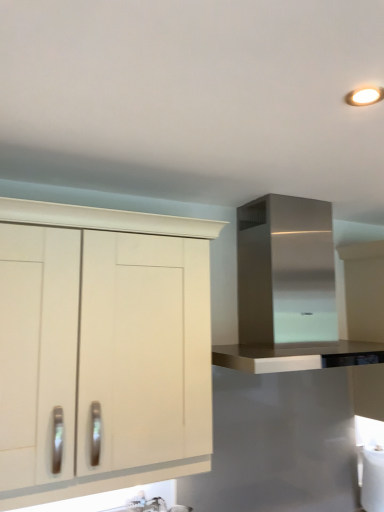
Question: Is white matte cabinet at left, which is the 2th cabinetry in right-to-left order, completely or partially inside stainless steel range hood at upper right, placed as the 2th cabinetry when sorted from left to right?

Choices:
 (A) no
 (B) yes

Answer: (A)

Question: Considering the relative sizes of stainless steel range hood at upper right, the first cabinetry in the right-to-left sequence, and white matte cabinet at left, which is counted as the 1th cabinetry, starting from the left, in the image provided, is stainless steel range hood at upper right, the first cabinetry in the right-to-left sequence, shorter than white matte cabinet at left, which is counted as the 1th cabinetry, starting from the left,?

Choices:
 (A) yes
 (B) no

Answer: (A)

Question: Is stainless steel range hood at upper right, the first cabinetry in the right-to-left sequence, positioned in front of white matte cabinet at left, which is the 2th cabinetry in right-to-left order?

Choices:
 (A) no
 (B) yes

Answer: (A)

Question: Does stainless steel range hood at upper right, the first cabinetry in the right-to-left sequence, turn towards white matte cabinet at left, which is the 2th cabinetry in right-to-left order?

Choices:
 (A) yes
 (B) no

Answer: (B)

Question: Considering the relative sizes of stainless steel range hood at upper right, placed as the 2th cabinetry when sorted from left to right, and white matte cabinet at left, which is counted as the 1th cabinetry, starting from the left, in the image provided, is stainless steel range hood at upper right, placed as the 2th cabinetry when sorted from left to right, wider than white matte cabinet at left, which is counted as the 1th cabinetry, starting from the left,?

Choices:
 (A) no
 (B) yes

Answer: (B)

Question: From the image's perspective, is stainless steel range hood at upper right, the first cabinetry in the right-to-left sequence, below white matte cabinet at left, which is counted as the 1th cabinetry, starting from the left?

Choices:
 (A) yes
 (B) no

Answer: (B)

Question: Can you confirm if white matte cabinet at left, which is counted as the 1th cabinetry, starting from the left, is wider than stainless steel range hood at upper right, placed as the 2th cabinetry when sorted from left to right?

Choices:
 (A) no
 (B) yes

Answer: (A)

Question: Does white matte cabinet at left, which is the 2th cabinetry in right-to-left order, have a greater height compared to stainless steel range hood at upper right, placed as the 2th cabinetry when sorted from left to right?

Choices:
 (A) yes
 (B) no

Answer: (A)

Question: From a real-world perspective, is white matte cabinet at left, which is counted as the 1th cabinetry, starting from the left, physically above stainless steel range hood at upper right, the first cabinetry in the right-to-left sequence?

Choices:
 (A) no
 (B) yes

Answer: (A)

Question: Can you confirm if white matte cabinet at left, which is the 2th cabinetry in right-to-left order, is thinner than stainless steel range hood at upper right, placed as the 2th cabinetry when sorted from left to right?

Choices:
 (A) yes
 (B) no

Answer: (A)

Question: Is white matte cabinet at left, which is counted as the 1th cabinetry, starting from the left, surrounding stainless steel range hood at upper right, placed as the 2th cabinetry when sorted from left to right?

Choices:
 (A) yes
 (B) no

Answer: (B)

Question: From the image's perspective, would you say white matte cabinet at left, which is the 2th cabinetry in right-to-left order, is positioned over stainless steel range hood at upper right, placed as the 2th cabinetry when sorted from left to right?

Choices:
 (A) yes
 (B) no

Answer: (B)

Question: In terms of size, does stainless steel range hood at upper right, the first cabinetry in the right-to-left sequence, appear bigger or smaller than white matte cabinet at left, which is counted as the 1th cabinetry, starting from the left?

Choices:
 (A) small
 (B) big

Answer: (B)